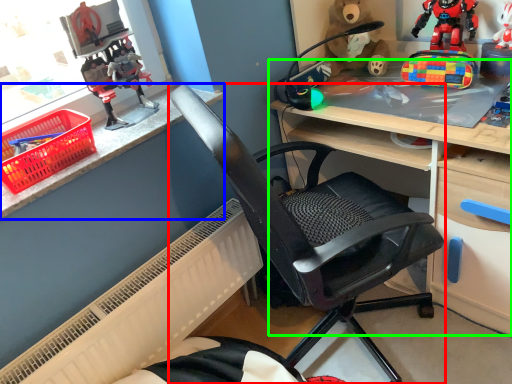
Question: Considering the real-world distances, which object is closest to chair (highlighted by a red box)? counter top (highlighted by a blue box) or desk (highlighted by a green box).

Choices:
 (A) counter top
 (B) desk

Answer: (B)